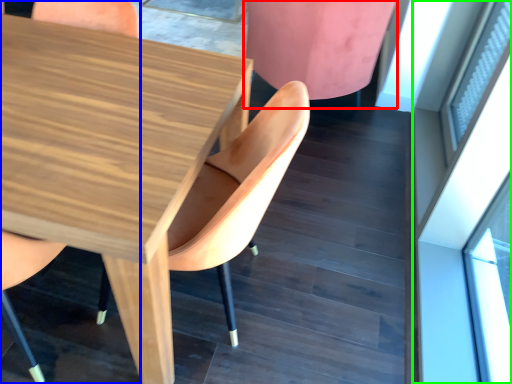
Question: Which object is positioned closest to chair (highlighted by a red box)? Select from chair (highlighted by a blue box) and glass door (highlighted by a green box).

Choices:
 (A) chair
 (B) glass door

Answer: (B)